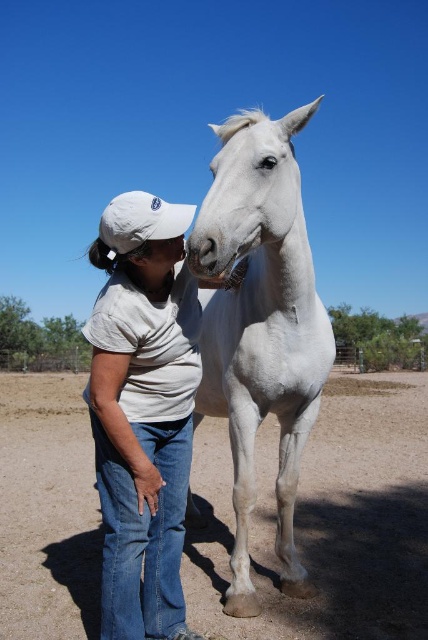
Where is `brown sandy dirt at lower center`? The width and height of the screenshot is (428, 640). brown sandy dirt at lower center is located at coordinates (326, 520).

Is brown sandy dirt at lower center to the right of white glossy horse at center from the viewer's perspective?

No, brown sandy dirt at lower center is not to the right of white glossy horse at center.

Who is more distant from viewer, (8, 577) or (291, 490)?

The point (8, 577) is behind.

Where is `brown sandy dirt at lower center`? This screenshot has width=428, height=640. brown sandy dirt at lower center is located at coordinates (326, 520).

Does point (134, 211) come farther from viewer compared to point (303, 387)?

No, (134, 211) is closer to viewer.

Measure the distance from white cotton shirt at center to white glossy horse at center.

21.96 inches

Where is `white cotton shirt at center`? white cotton shirt at center is located at coordinates (143, 410).

Identify the location of white cotton shirt at center. (143, 410).

Does point (407, 397) come closer to viewer compared to point (177, 529)?

No.

Is brown sandy dirt at lower center to the left of white cotton shirt at center from the viewer's perspective?

Yes, brown sandy dirt at lower center is to the left of white cotton shirt at center.

Describe the element at coordinates (326, 520) in the screenshot. Image resolution: width=428 pixels, height=640 pixels. I see `brown sandy dirt at lower center` at that location.

In order to click on brown sandy dirt at lower center in this screenshot , I will do `click(326, 520)`.